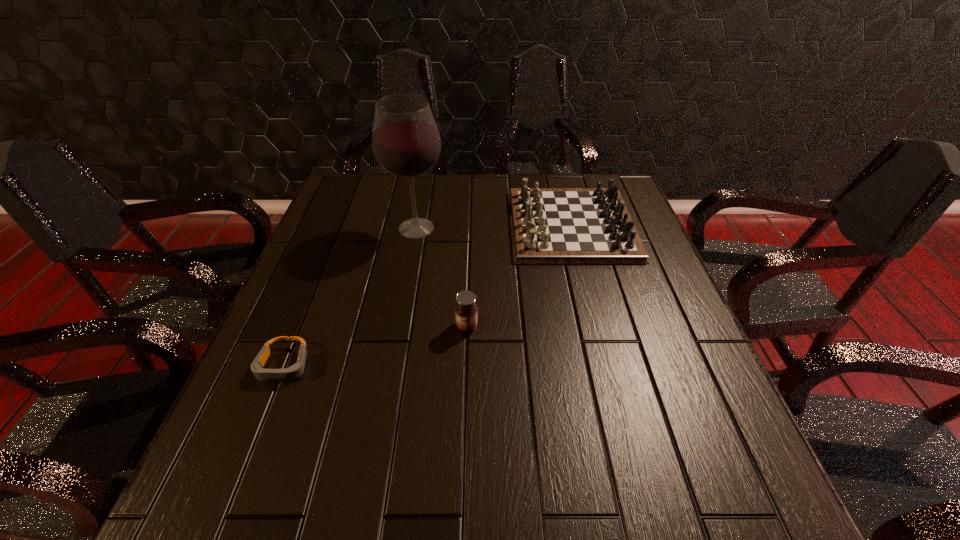
Locate an element on the screen. The height and width of the screenshot is (540, 960). vacant space at the left edge is located at coordinates (310, 381).

Where is `vacant position at the right edge of the desktop`? The image size is (960, 540). vacant position at the right edge of the desktop is located at coordinates (651, 406).

Find the location of a particular element. This screenshot has height=540, width=960. free space at the far left corner of the desktop is located at coordinates (355, 210).

The image size is (960, 540). In order to click on free space at the near left corner of the desktop in this screenshot , I will do [263, 475].

Identify the location of empty space that is in between the chessboard and the tallest object. This screenshot has width=960, height=540. (494, 227).

Locate an element on the screen. free spot between the alcohol and the leftmost object is located at coordinates (350, 297).

Where is `free space between the nearest object and the second nearest object`? This screenshot has height=540, width=960. free space between the nearest object and the second nearest object is located at coordinates (375, 346).

Identify the location of blank region between the tallest object and the goggles. (350, 297).

Locate an element on the screen. The width and height of the screenshot is (960, 540). blank region between the second nearest object and the chessboard is located at coordinates (519, 275).

Find the location of a particular element. free space that is in between the chessboard and the third object from left to right is located at coordinates (519, 275).